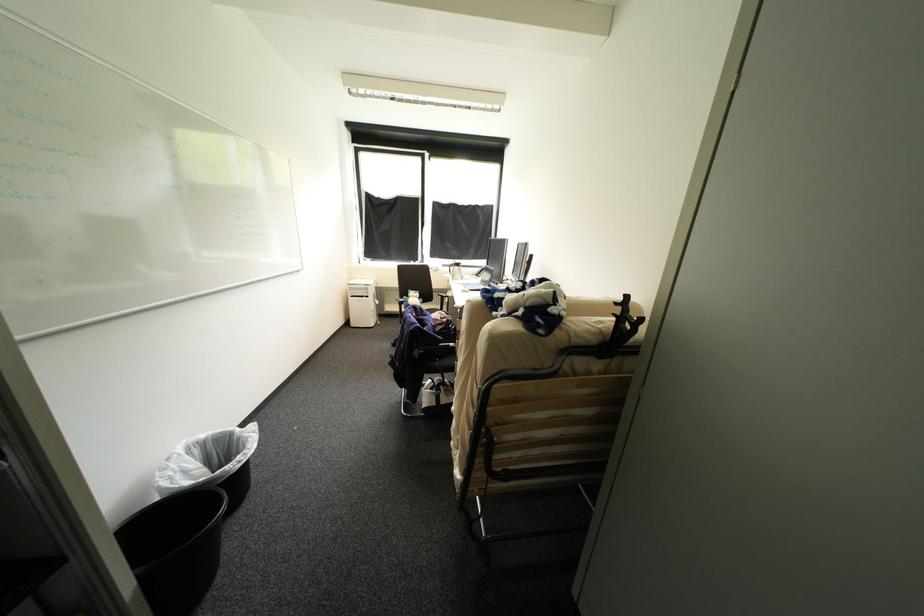
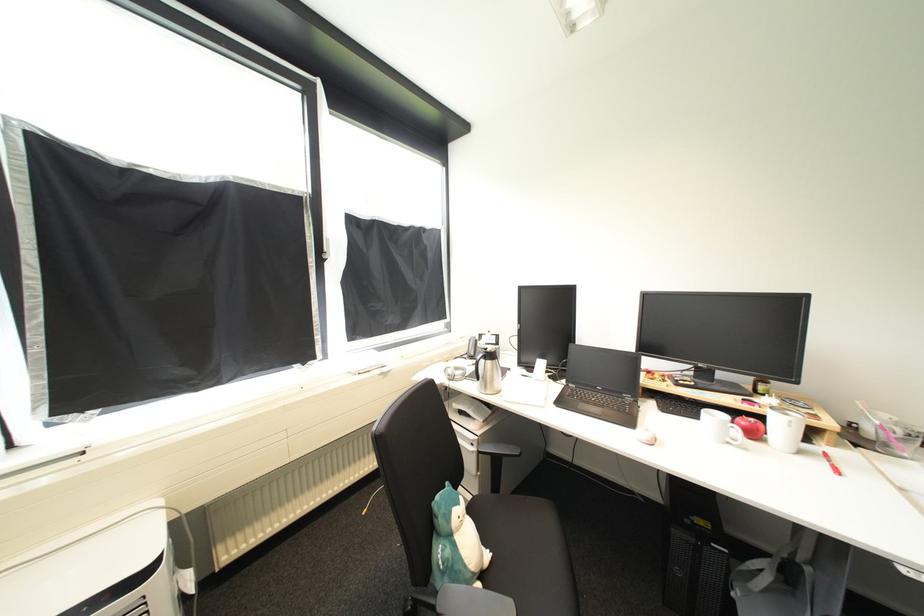
The point at (463, 268) is marked in the first image. Where is the corresponding point in the second image?

(495, 363)